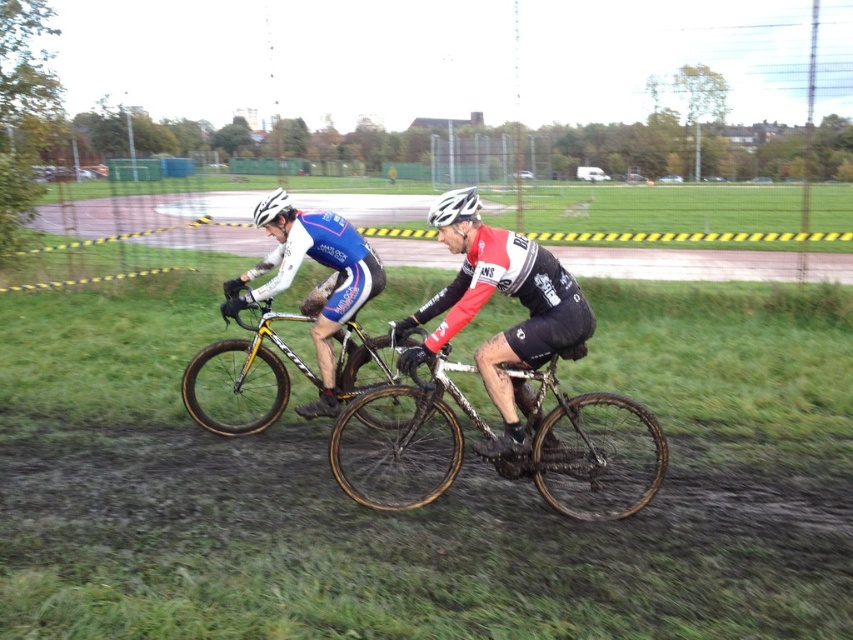
You are a photographer trying to capture a photo of the shiny black cycling jersey at center and the yellow matte bicycle at center. Based on their sizes in the image, which one should you zoom in on more to ensure both are clearly visible in the frame?

The shiny black cycling jersey at center is much taller than the yellow matte bicycle at center, so you should zoom in more on the jersey to ensure both are clearly visible in the frame.

You are a photographer standing at the edge of the cyclocross track. You want to capture a photo of both the muddy metallic bicycle at center and the white matte bicycle helmet at center in the same frame. Given that your camera has a maximum focus range of 5 feet, will you be able to include both objects in focus without moving your position?

The distance between the muddy metallic bicycle at center and the white matte bicycle helmet at center is 5.79 feet. Since the camera can only focus within 5 feet, the objects are too far apart to be in focus simultaneously. You will need to adjust your position or use a different camera setting.

You are a spectator at the cyclocross race. You see the muddy metallic bicycle at center and the matte blue cycling jersey at center. Which object is positioned to the right of the other?

The muddy metallic bicycle at center is to the right of the matte blue cycling jersey at center.